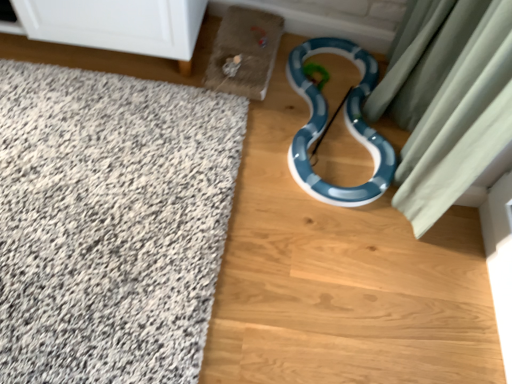
The image size is (512, 384). In order to click on free point above blue glossy dirt track at center-right (from a real-world perspective) in this screenshot , I will do pos(178,165).